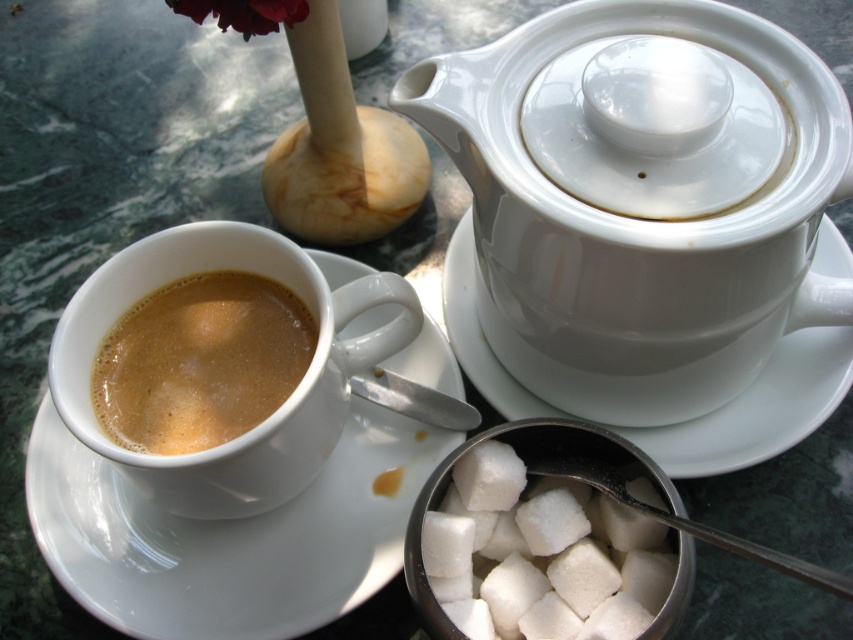
Is white sugar cubes at center shorter than silver metallic spoon at center?

Incorrect, white sugar cubes at center's height does not fall short of silver metallic spoon at center's.

Is white sugar cubes at center bigger than silver metallic spoon at center?

Incorrect, white sugar cubes at center is not larger than silver metallic spoon at center.

What do you see at coordinates (543, 545) in the screenshot? This screenshot has height=640, width=853. I see `white sugar cubes at center` at bounding box center [543, 545].

Identify the location of white sugar cubes at center. (543, 545).

Which is above, white glossy teapot at upper center or brown matte cup at lower left?

white glossy teapot at upper center

Who is more forward, (560, 348) or (122, 406)?

Point (122, 406) is in front.

This screenshot has width=853, height=640. Identify the location of white glossy teapot at upper center. (642, 196).

Does white ceramic saucer at center appear under white sugar cubes at center?

Incorrect, white ceramic saucer at center is not positioned below white sugar cubes at center.

Is white ceramic saucer at center to the right of white sugar cubes at center from the viewer's perspective?

Yes, white ceramic saucer at center is to the right of white sugar cubes at center.

Image resolution: width=853 pixels, height=640 pixels. I want to click on white ceramic saucer at center, so click(757, 410).